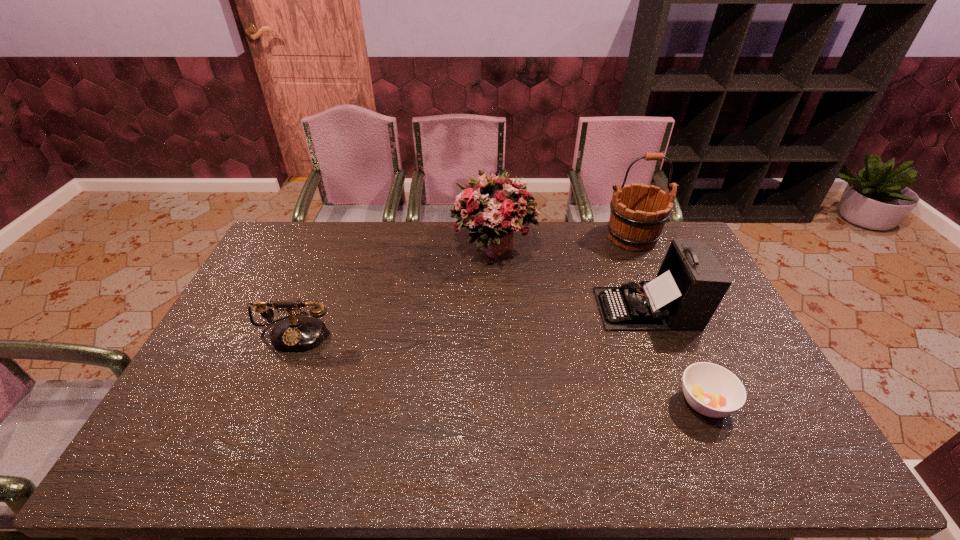
Locate an element on the screen. The image size is (960, 540). empty location between the bouquet and the soup bowl is located at coordinates (599, 325).

Image resolution: width=960 pixels, height=540 pixels. I want to click on empty location between the typewriter and the bouquet, so click(x=571, y=278).

What are the coordinates of `free space between the nearest object and the fourth object from right to left` in the screenshot? It's located at (599, 325).

At what (x,y) coordinates should I click in order to perform the action: click on vacant area between the leftmost object and the typewriter. Please return your answer as a coordinate pair (x, y). Looking at the image, I should click on (472, 320).

Where is `free spot between the telephone and the second tallest object`? free spot between the telephone and the second tallest object is located at coordinates (396, 289).

Choose which object is the third nearest neighbor to the tallest object. Please provide its 2D coordinates. Your answer should be formatted as a tuple, i.e. [(x, y)], where the tuple contains the x and y coordinates of a point satisfying the conditions above.

[(712, 390)]

You are a GUI agent. You are given a task and a screenshot of the screen. Output one action in this format:
    pyautogui.click(x=<x>, y=<y>)
    Task: Click on the object that stands as the fourth closest to the wine bucket
    The height and width of the screenshot is (540, 960).
    Given the screenshot: What is the action you would take?
    pyautogui.click(x=295, y=333)

Image resolution: width=960 pixels, height=540 pixels. I want to click on vacant area that satisfies the following two spatial constraints: 1. on the dial of the second shortest object; 2. on the right side of the soup bowl, so click(x=267, y=402).

Where is `vacant space that satisfies the following two spatial constraints: 1. on the dial of the telephone; 2. on the left side of the shortest object`? The height and width of the screenshot is (540, 960). vacant space that satisfies the following two spatial constraints: 1. on the dial of the telephone; 2. on the left side of the shortest object is located at coordinates (267, 402).

Find the location of `vacant area that satisfies the following two spatial constraints: 1. inside the open case of the shortest object; 2. on the right side of the third tallest object`. vacant area that satisfies the following two spatial constraints: 1. inside the open case of the shortest object; 2. on the right side of the third tallest object is located at coordinates (685, 402).